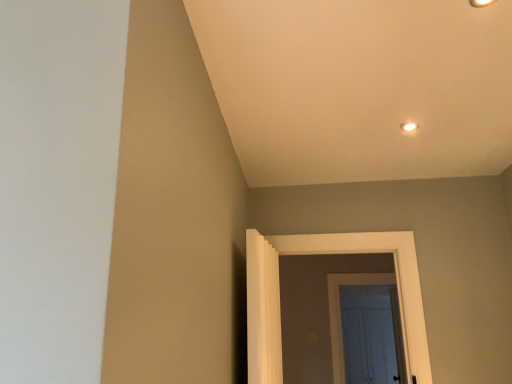
What do you see at coordinates (481, 3) in the screenshot? I see `matte gold light fixture at upper right, the second light fixture viewed from the back` at bounding box center [481, 3].

What do you see at coordinates (339, 311) in the screenshot? Image resolution: width=512 pixels, height=384 pixels. I see `white wooden door at center, marked as the 1th door in a back-to-front arrangement` at bounding box center [339, 311].

The height and width of the screenshot is (384, 512). Identify the location of white glossy light fixture at upper center, which is the second light fixture from top to bottom. (409, 126).

In order to face white glossy light fixture at upper center, which ranks as the first light fixture in bottom-to-top order, should I rotate leftwards or rightwards?

Rotate right and turn 19.867 degrees.

The width and height of the screenshot is (512, 384). Find the location of `white painted wood door at center, which is the 2th door in right-to-left order`. white painted wood door at center, which is the 2th door in right-to-left order is located at coordinates (319, 254).

At what (x,y) coordinates should I click in order to perform the action: click on matte gold light fixture at upper right, the second light fixture viewed from the back. Please return your answer as a coordinate pair (x, y). This screenshot has width=512, height=384. Looking at the image, I should click on (481, 3).

Is white painted wood door at center, arranged as the first door when viewed from the front, positioned behind white wooden door at center, arranged as the 2th door when viewed from the left?

No, it is not.

How many degrees apart are the facing directions of white painted wood door at center, arranged as the first door when viewed from the front, and white wooden door at center, marked as the 1th door in a back-to-front arrangement?

The angular difference between white painted wood door at center, arranged as the first door when viewed from the front, and white wooden door at center, marked as the 1th door in a back-to-front arrangement, is 1.51 degrees.

Consider the image. From the image's perspective, is white painted wood door at center, which is the 2th door in right-to-left order, below white wooden door at center, marked as the 1th door in a back-to-front arrangement?

Actually, white painted wood door at center, which is the 2th door in right-to-left order, appears above white wooden door at center, marked as the 1th door in a back-to-front arrangement, in the image.

Is white painted wood door at center, which is counted as the second door, starting from the back, directly adjacent to white wooden door at center, positioned as the 1th door in right-to-left order?

white painted wood door at center, which is counted as the second door, starting from the back, and white wooden door at center, positioned as the 1th door in right-to-left order, are clearly separated.

Visually, is matte gold light fixture at upper right, the 1th light fixture viewed from the front, positioned to the left or to the right of white wooden door at center, the 2th door from the front?

Clearly, matte gold light fixture at upper right, the 1th light fixture viewed from the front, is on the left of white wooden door at center, the 2th door from the front, in the image.

From a real-world perspective, which object rests below the other?

white wooden door at center, positioned as the 1th door in right-to-left order.

Are matte gold light fixture at upper right, marked as the first light fixture in a top-to-bottom arrangement, and white wooden door at center, positioned as the 1th door in right-to-left order, beside each other?

No.

Consider the image. Can you confirm if matte gold light fixture at upper right, marked as the first light fixture in a top-to-bottom arrangement, is bigger than white wooden door at center, arranged as the 2th door when viewed from the left?

No, matte gold light fixture at upper right, marked as the first light fixture in a top-to-bottom arrangement, is not bigger than white wooden door at center, arranged as the 2th door when viewed from the left.

Is matte gold light fixture at upper right, the 1th light fixture viewed from the front, oriented towards white glossy light fixture at upper center, which ranks as the first light fixture in bottom-to-top order?

No, matte gold light fixture at upper right, the 1th light fixture viewed from the front, does not turn towards white glossy light fixture at upper center, which ranks as the first light fixture in bottom-to-top order.

Between matte gold light fixture at upper right, the 1th light fixture viewed from the front, and white glossy light fixture at upper center, placed as the 2th light fixture when sorted from front to back, which one has more height?

With more height is matte gold light fixture at upper right, the 1th light fixture viewed from the front.

Image resolution: width=512 pixels, height=384 pixels. Find the location of `light fixture that is below the matte gold light fixture at upper right, the second light fixture viewed from the back (from the image's perspective)`. light fixture that is below the matte gold light fixture at upper right, the second light fixture viewed from the back (from the image's perspective) is located at coordinates (409, 126).

Is matte gold light fixture at upper right, the 1th light fixture viewed from the front, positioned far away from white glossy light fixture at upper center, which is the first light fixture in back-to-front order?

No, matte gold light fixture at upper right, the 1th light fixture viewed from the front, is not far away from white glossy light fixture at upper center, which is the first light fixture in back-to-front order.

Based on the photo, is white painted wood door at center, arranged as the first door when viewed from the front, oriented towards matte gold light fixture at upper right, which is counted as the second light fixture, starting from the bottom?

Yes, white painted wood door at center, arranged as the first door when viewed from the front, is aimed at matte gold light fixture at upper right, which is counted as the second light fixture, starting from the bottom.

Is matte gold light fixture at upper right, the 1th light fixture viewed from the front, completely or partially inside white painted wood door at center, which is the 2th door in right-to-left order?

No, matte gold light fixture at upper right, the 1th light fixture viewed from the front, is not inside white painted wood door at center, which is the 2th door in right-to-left order.

Looking at this image, from a real-world perspective, is white painted wood door at center, arranged as the first door when viewed from the front, beneath matte gold light fixture at upper right, the second light fixture viewed from the back?

Yes, from a real-world perspective, white painted wood door at center, arranged as the first door when viewed from the front, is below matte gold light fixture at upper right, the second light fixture viewed from the back.

Considering the positions of objects white painted wood door at center, arranged as the first door when viewed from the front, and matte gold light fixture at upper right, the 1th light fixture viewed from the front, in the image provided, who is more to the right, white painted wood door at center, arranged as the first door when viewed from the front, or matte gold light fixture at upper right, the 1th light fixture viewed from the front,?

matte gold light fixture at upper right, the 1th light fixture viewed from the front.

Looking at this image, how many degrees apart are the facing directions of white glossy light fixture at upper center, which is the first light fixture in back-to-front order, and white painted wood door at center, arranged as the first door when viewed from the front?

The angular difference between white glossy light fixture at upper center, which is the first light fixture in back-to-front order, and white painted wood door at center, arranged as the first door when viewed from the front, is 9.85 degrees.

Where is `door that is the 1st object directly below the white glossy light fixture at upper center, which ranks as the first light fixture in bottom-to-top order (from a real-world perspective)`? door that is the 1st object directly below the white glossy light fixture at upper center, which ranks as the first light fixture in bottom-to-top order (from a real-world perspective) is located at coordinates (319, 254).

Between white glossy light fixture at upper center, placed as the 2th light fixture when sorted from front to back, and white painted wood door at center, which ranks as the 1th door in left-to-right order, which one has less height?

Standing shorter between the two is white glossy light fixture at upper center, placed as the 2th light fixture when sorted from front to back.

Is white glossy light fixture at upper center, which ranks as the first light fixture in bottom-to-top order, directly adjacent to white painted wood door at center, which is the 2th door in right-to-left order?

No, white glossy light fixture at upper center, which ranks as the first light fixture in bottom-to-top order, is not in contact with white painted wood door at center, which is the 2th door in right-to-left order.

Which is nearer, (x=478, y=7) or (x=370, y=238)?

Point (x=478, y=7) is closer to the camera than point (x=370, y=238).

Considering the relative sizes of matte gold light fixture at upper right, the 1th light fixture viewed from the front, and white painted wood door at center, arranged as the first door when viewed from the front, in the image provided, is matte gold light fixture at upper right, the 1th light fixture viewed from the front, wider than white painted wood door at center, arranged as the first door when viewed from the front,?

No, matte gold light fixture at upper right, the 1th light fixture viewed from the front, is not wider than white painted wood door at center, arranged as the first door when viewed from the front.

Can you confirm if matte gold light fixture at upper right, marked as the first light fixture in a top-to-bottom arrangement, is taller than white painted wood door at center, arranged as the first door when viewed from the front?

In fact, matte gold light fixture at upper right, marked as the first light fixture in a top-to-bottom arrangement, may be shorter than white painted wood door at center, arranged as the first door when viewed from the front.

From the picture: Is matte gold light fixture at upper right, which is counted as the second light fixture, starting from the bottom, far away from white painted wood door at center, which is the 2th door in right-to-left order?

Yes, matte gold light fixture at upper right, which is counted as the second light fixture, starting from the bottom, and white painted wood door at center, which is the 2th door in right-to-left order, are located far from each other.

From the image's perspective, which one is positioned higher, white wooden door at center, positioned as the 1th door in right-to-left order, or white painted wood door at center, which is counted as the second door, starting from the back?

white painted wood door at center, which is counted as the second door, starting from the back, appears higher in the image.

I want to click on door behind the white painted wood door at center, arranged as the first door when viewed from the front, so click(x=339, y=311).

Is white painted wood door at center, which is counted as the second door, starting from the back, a part of white wooden door at center, the 2th door from the front?

No, white painted wood door at center, which is counted as the second door, starting from the back, is not surrounded by white wooden door at center, the 2th door from the front.

Considering the positions of points (337, 324) and (410, 239), is point (337, 324) farther from camera compared to point (410, 239)?

Yes, it is behind point (410, 239).

Identify the location of door that is above the white wooden door at center, positioned as the 1th door in right-to-left order (from a real-world perspective). (319, 254).

At what (x,y) coordinates should I click in order to perform the action: click on door to the right of matte gold light fixture at upper right, which is counted as the second light fixture, starting from the bottom. Please return your answer as a coordinate pair (x, y). Image resolution: width=512 pixels, height=384 pixels. Looking at the image, I should click on (339, 311).

Which object lies nearer to the anchor point white wooden door at center, the 2th door from the front, matte gold light fixture at upper right, marked as the first light fixture in a top-to-bottom arrangement, or white glossy light fixture at upper center, which is the first light fixture in back-to-front order?

white glossy light fixture at upper center, which is the first light fixture in back-to-front order, lies closer to white wooden door at center, the 2th door from the front, than the other object.

Based on their spatial positions, is matte gold light fixture at upper right, which is counted as the second light fixture, starting from the bottom, or white painted wood door at center, arranged as the first door when viewed from the front, closer to white glossy light fixture at upper center, placed as the 2th light fixture when sorted from front to back?

matte gold light fixture at upper right, which is counted as the second light fixture, starting from the bottom, lies closer to white glossy light fixture at upper center, placed as the 2th light fixture when sorted from front to back, than the other object.

Estimate the real-world distances between objects in this image. Which object is further from white painted wood door at center, which is the 2th door in right-to-left order, white wooden door at center, arranged as the 2th door when viewed from the left, or white glossy light fixture at upper center, which is the second light fixture from top to bottom?

Based on the image, white wooden door at center, arranged as the 2th door when viewed from the left, appears to be further to white painted wood door at center, which is the 2th door in right-to-left order.

Considering their positions, is white glossy light fixture at upper center, placed as the 2th light fixture when sorted from front to back, positioned further to white wooden door at center, the 2th door from the front, than matte gold light fixture at upper right, the 1th light fixture viewed from the front?

matte gold light fixture at upper right, the 1th light fixture viewed from the front, lies further to white wooden door at center, the 2th door from the front, than the other object.

Estimate the real-world distances between objects in this image. Which object is closer to white wooden door at center, arranged as the 2th door when viewed from the left, white glossy light fixture at upper center, which ranks as the first light fixture in bottom-to-top order, or white painted wood door at center, which ranks as the 1th door in left-to-right order?

white painted wood door at center, which ranks as the 1th door in left-to-right order, is positioned closer to the anchor white wooden door at center, arranged as the 2th door when viewed from the left.

Looking at the image, which one is located closer to white painted wood door at center, which is the 2th door in right-to-left order, white glossy light fixture at upper center, placed as the 2th light fixture when sorted from front to back, or white wooden door at center, positioned as the 1th door in right-to-left order?

white glossy light fixture at upper center, placed as the 2th light fixture when sorted from front to back, lies closer to white painted wood door at center, which is the 2th door in right-to-left order, than the other object.

From the image, which object appears to be nearer to white glossy light fixture at upper center, which ranks as the first light fixture in bottom-to-top order, white wooden door at center, the 2th door from the front, or white painted wood door at center, which ranks as the 1th door in left-to-right order?

white painted wood door at center, which ranks as the 1th door in left-to-right order.

Which object lies further to the anchor point white glossy light fixture at upper center, which is the first light fixture in back-to-front order, white wooden door at center, arranged as the 2th door when viewed from the left, or matte gold light fixture at upper right, the second light fixture viewed from the back?

white wooden door at center, arranged as the 2th door when viewed from the left, lies further to white glossy light fixture at upper center, which is the first light fixture in back-to-front order, than the other object.

You are a GUI agent. You are given a task and a screenshot of the screen. Output one action in this format:
    pyautogui.click(x=<x>, y=<y>)
    Task: Click on the light fixture between matte gold light fixture at upper right, marked as the first light fixture in a top-to-bottom arrangement, and white wooden door at center, arranged as the 2th door when viewed from the left, along the z-axis
    
    Given the screenshot: What is the action you would take?
    pyautogui.click(x=409, y=126)

Locate an element on the screen. light fixture that lies between matte gold light fixture at upper right, the second light fixture viewed from the back, and white painted wood door at center, which is the 2th door in right-to-left order, from top to bottom is located at coordinates pos(409,126).

I want to click on door between matte gold light fixture at upper right, the 1th light fixture viewed from the front, and white wooden door at center, the 2th door from the front, from front to back, so click(319, 254).

Identify the location of door between white glossy light fixture at upper center, which is the second light fixture from top to bottom, and white wooden door at center, positioned as the 1th door in right-to-left order, along the z-axis. The width and height of the screenshot is (512, 384). (319, 254).